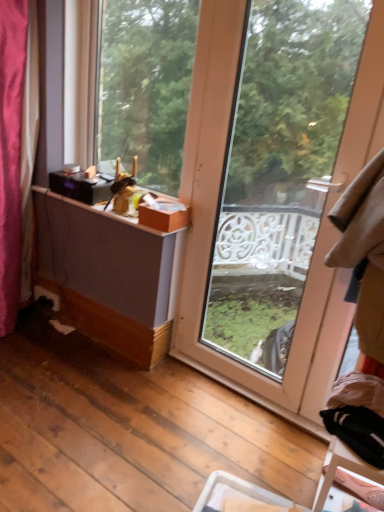
Find the location of a particular element. This screenshot has height=512, width=384. transparent glass door at center, the first window positioned from the right is located at coordinates (215, 218).

Considering the relative sizes of orange cardboard box at upper center and matte wood window at center, which ranks as the 1th window in left-to-right order, in the image provided, is orange cardboard box at upper center wider than matte wood window at center, which ranks as the 1th window in left-to-right order,?

Yes.

Is matte wood window at center, which ranks as the 1th window in left-to-right order, located within orange cardboard box at upper center?

No, matte wood window at center, which ranks as the 1th window in left-to-right order, is not a part of orange cardboard box at upper center.

Is there a large distance between orange cardboard box at upper center and matte wood window at center, which ranks as the second window in right-to-left order?

No.

From a real-world perspective, is orange cardboard box at upper center on top of matte wood window at center, which ranks as the second window in right-to-left order?

No, from a real-world perspective, orange cardboard box at upper center is not over matte wood window at center, which ranks as the second window in right-to-left order

Could you tell me if matte wood window at center, which ranks as the 1th window in left-to-right order, is turned towards transparent glass door at center, the first window positioned from the right?

No, matte wood window at center, which ranks as the 1th window in left-to-right order, is not turned towards transparent glass door at center, the first window positioned from the right.

Based on the photo, between matte wood window at center, which ranks as the second window in right-to-left order, and transparent glass door at center, the first window positioned from the right, which one appears on the left side from the viewer's perspective?

From the viewer's perspective, matte wood window at center, which ranks as the second window in right-to-left order, appears more on the left side.

Can you confirm if matte wood window at center, which ranks as the second window in right-to-left order, is bigger than transparent glass door at center, placed as the second window when sorted from left to right?

→ No.

From the image's perspective, which is above, transparent glass door at center, the first window positioned from the right, or matte wood window at center, which ranks as the second window in right-to-left order?

matte wood window at center, which ranks as the second window in right-to-left order, is shown above in the image.

Is transparent glass door at center, the first window positioned from the right, far from matte wood window at center, which ranks as the 1th window in left-to-right order?

Actually, transparent glass door at center, the first window positioned from the right, and matte wood window at center, which ranks as the 1th window in left-to-right order, are a little close together.

Considering the relative sizes of transparent glass door at center, the first window positioned from the right, and matte wood window at center, which ranks as the 1th window in left-to-right order, in the image provided, is transparent glass door at center, the first window positioned from the right, thinner than matte wood window at center, which ranks as the 1th window in left-to-right order,?

Answer: Indeed, transparent glass door at center, the first window positioned from the right, has a lesser width compared to matte wood window at center, which ranks as the 1th window in left-to-right order.

Considering the relative sizes of transparent glass door at center, the first window positioned from the right, and matte wood window at center, which ranks as the 1th window in left-to-right order, in the image provided, is transparent glass door at center, the first window positioned from the right, smaller than matte wood window at center, which ranks as the 1th window in left-to-right order,?

Incorrect, transparent glass door at center, the first window positioned from the right, is not smaller in size than matte wood window at center, which ranks as the 1th window in left-to-right order.

How many degrees apart are the facing directions of orange cardboard box at upper center and transparent glass door at center, placed as the second window when sorted from left to right?

The facing directions of orange cardboard box at upper center and transparent glass door at center, placed as the second window when sorted from left to right, are 0.328 degrees apart.

Considering the relative sizes of orange cardboard box at upper center and transparent glass door at center, the first window positioned from the right, in the image provided, is orange cardboard box at upper center taller than transparent glass door at center, the first window positioned from the right,?

No, orange cardboard box at upper center is not taller than transparent glass door at center, the first window positioned from the right.

From the picture: Is orange cardboard box at upper center beside transparent glass door at center, the first window positioned from the right?

They are not placed beside each other.

Is orange cardboard box at upper center bigger than transparent glass door at center, placed as the second window when sorted from left to right?

No, orange cardboard box at upper center is not bigger than transparent glass door at center, placed as the second window when sorted from left to right.

Where is `box beneath the transparent glass door at center, placed as the second window when sorted from left to right (from a real-world perspective)`? The image size is (384, 512). box beneath the transparent glass door at center, placed as the second window when sorted from left to right (from a real-world perspective) is located at coordinates (164, 215).

How different are the orientations of transparent glass door at center, the first window positioned from the right, and orange cardboard box at upper center in degrees?

They differ by 0.328 degrees in their facing directions.

Is transparent glass door at center, placed as the second window when sorted from left to right, thinner than orange cardboard box at upper center?

Indeed, transparent glass door at center, placed as the second window when sorted from left to right, has a lesser width compared to orange cardboard box at upper center.

Which point is more distant from viewer, (174, 168) or (189, 213)?

The point (174, 168) is more distant.

Which of these two, matte wood window at center, which ranks as the second window in right-to-left order, or orange cardboard box at upper center, stands taller?

matte wood window at center, which ranks as the second window in right-to-left order.

From a real-world perspective, who is located higher, matte wood window at center, which ranks as the 1th window in left-to-right order, or orange cardboard box at upper center?

In real-world perspective, matte wood window at center, which ranks as the 1th window in left-to-right order, is above.

Can orange cardboard box at upper center be found inside matte wood window at center, which ranks as the second window in right-to-left order?

Definitely not — orange cardboard box at upper center is not inside matte wood window at center, which ranks as the second window in right-to-left order.

At what (x,y) coordinates should I click in order to perform the action: click on box behind the matte wood window at center, which ranks as the second window in right-to-left order. Please return your answer as a coordinate pair (x, y). Looking at the image, I should click on (164, 215).

This screenshot has width=384, height=512. Find the location of `window above the transparent glass door at center, placed as the second window when sorted from left to right (from the image's perspective)`. window above the transparent glass door at center, placed as the second window when sorted from left to right (from the image's perspective) is located at coordinates (145, 86).

When comparing their distances from transparent glass door at center, placed as the second window when sorted from left to right, does matte wood window at center, which ranks as the 1th window in left-to-right order, or orange cardboard box at upper center seem closer?

The object closer to transparent glass door at center, placed as the second window when sorted from left to right, is orange cardboard box at upper center.

From the image, which object appears to be nearer to matte wood window at center, which ranks as the 1th window in left-to-right order, transparent glass door at center, placed as the second window when sorted from left to right, or orange cardboard box at upper center?

transparent glass door at center, placed as the second window when sorted from left to right, is closer to matte wood window at center, which ranks as the 1th window in left-to-right order.

Based on the photo, considering their positions, is orange cardboard box at upper center positioned closer to transparent glass door at center, the first window positioned from the right, than matte wood window at center, which ranks as the second window in right-to-left order?

Based on the image, orange cardboard box at upper center appears to be nearer to transparent glass door at center, the first window positioned from the right.

Considering their positions, is matte wood window at center, which ranks as the 1th window in left-to-right order, positioned further to orange cardboard box at upper center than transparent glass door at center, the first window positioned from the right?

matte wood window at center, which ranks as the 1th window in left-to-right order, lies further to orange cardboard box at upper center than the other object.

Based on their spatial positions, is transparent glass door at center, placed as the second window when sorted from left to right, or matte wood window at center, which ranks as the second window in right-to-left order, further from orange cardboard box at upper center?

matte wood window at center, which ranks as the second window in right-to-left order, lies further to orange cardboard box at upper center than the other object.

Looking at the image, which one is located closer to matte wood window at center, which ranks as the second window in right-to-left order, orange cardboard box at upper center or transparent glass door at center, the first window positioned from the right?

transparent glass door at center, the first window positioned from the right.

Where is `box that lies between matte wood window at center, which ranks as the second window in right-to-left order, and transparent glass door at center, placed as the second window when sorted from left to right, from top to bottom`? This screenshot has width=384, height=512. box that lies between matte wood window at center, which ranks as the second window in right-to-left order, and transparent glass door at center, placed as the second window when sorted from left to right, from top to bottom is located at coordinates (164, 215).